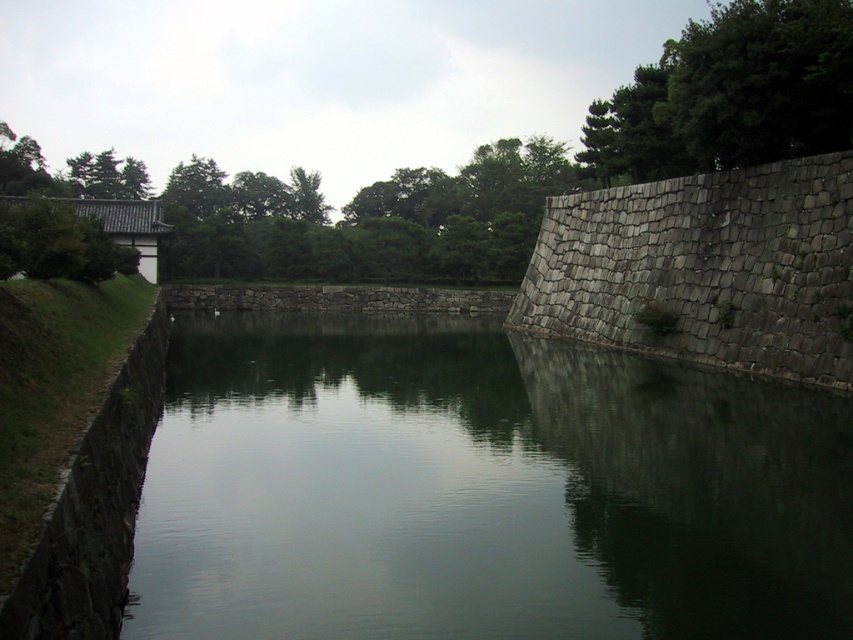
You are standing at the edge of the scene and want to walk towards the green stone wall at center and the dark gray stone moat at left. Which object will you reach first?

The green stone wall at center is closer to you than the dark gray stone moat at left, so you will reach the green stone wall at center first.

You are standing at the edge of the dark gray stone moat at left and want to cross to the green stone wall at center. Which direction should you move to reach it?

The green stone wall at center is positioned on the right side of the dark gray stone moat at left, so you should move to your right to reach it.